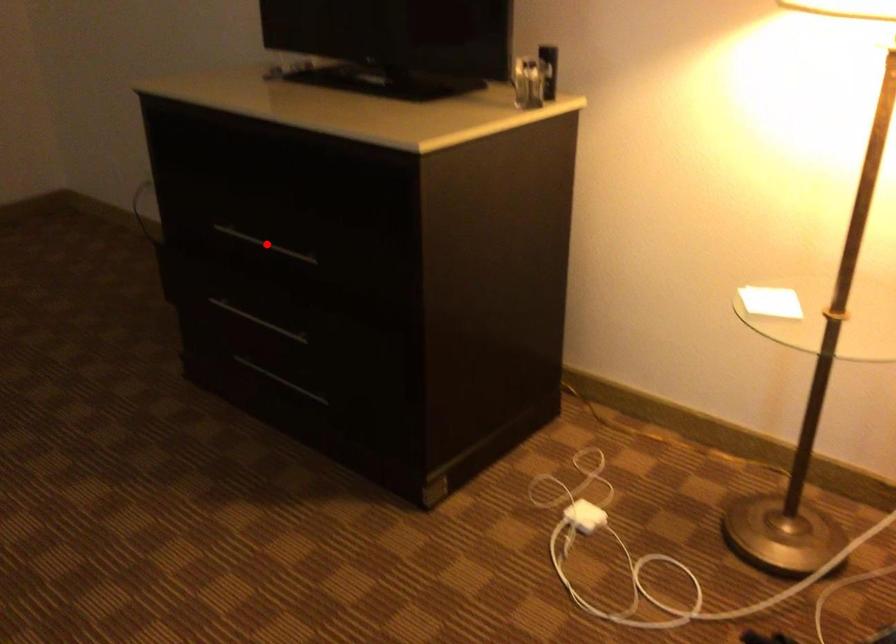
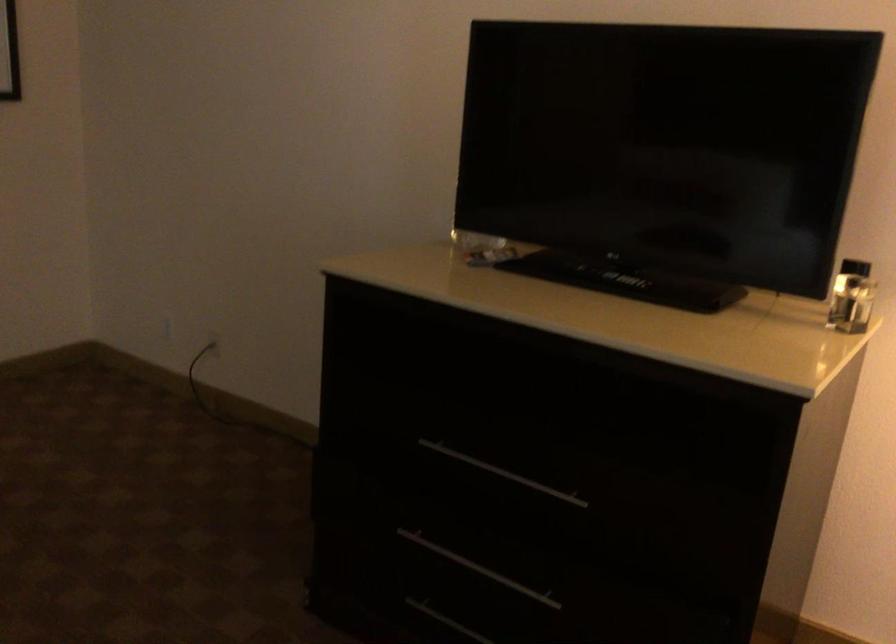
Question: I am providing you with two images of the same scene from different viewpoints. In image1, a red point is highlighted. Considering the same 3D point in image2, which of the following is correct?

Choices:
 (A) It is closer
 (B) It is farther

Answer: (A)